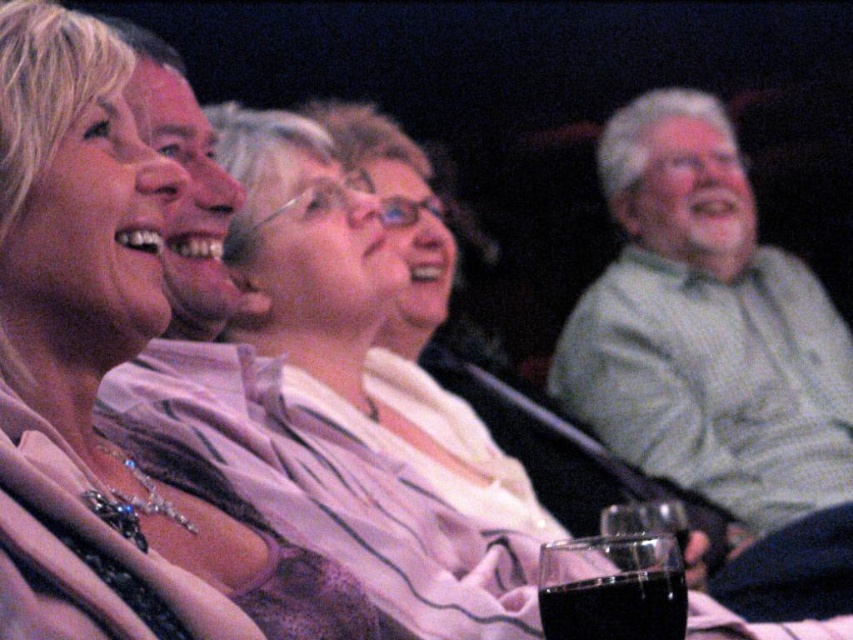
You are a photographer trying to capture a candid shot of the matte black face at upper left and the black glass at lower center. Since you want to frame both subjects in your shot, which one should you position closer to the left edge of your camera frame?

The matte black face at upper left is positioned on the left side of black glass at lower center, so to frame both subjects, you should position the matte black face at upper left closer to the left edge of your camera frame since it is already on the left side of the black glass at lower center.

You are sitting in the theater and want to pass a note to someone behind you. You see two points marked in the image. Which point, point (151, 552) or point (631, 602), is located behind you?

Point (151, 552) is behind point (631, 602), so if you are sitting at point (631, 602), then point (151, 552) is behind you.

You are a photographer trying to capture a candid shot of the green textured shirt at right and the matte black face at upper left. Since you want to ensure both are in focus, you need to know their relative sizes in the frame. Which object is taller?

The green textured shirt at right is much taller than the matte black face at upper left, so it will appear larger in the frame.